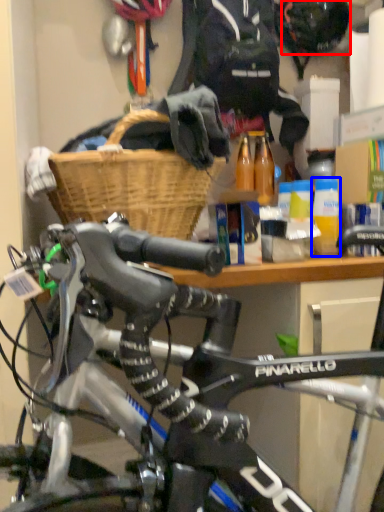
Question: Which point is closer to the camera, bicycle helmet (highlighted by a red box) or bottle (highlighted by a blue box)?

Choices:
 (A) bicycle helmet
 (B) bottle

Answer: (B)